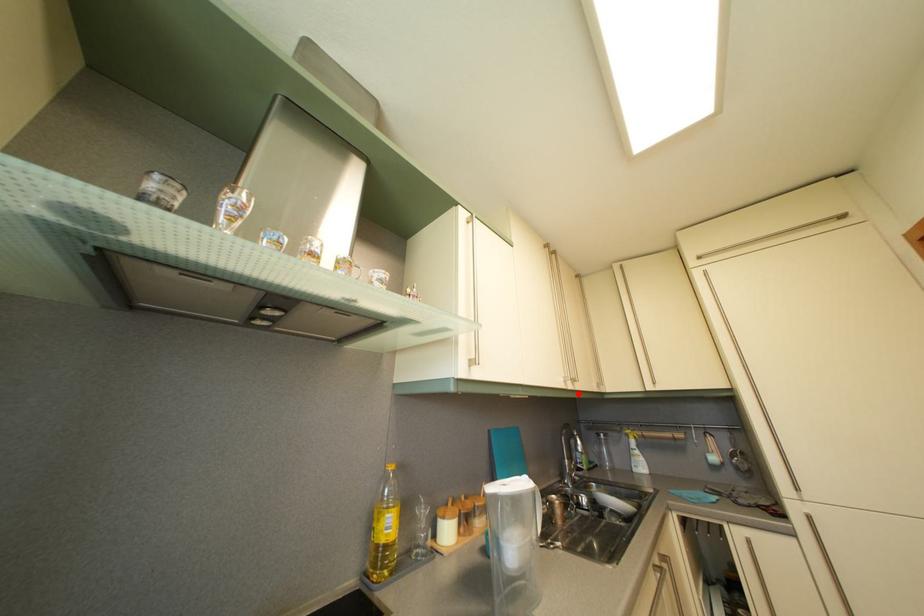
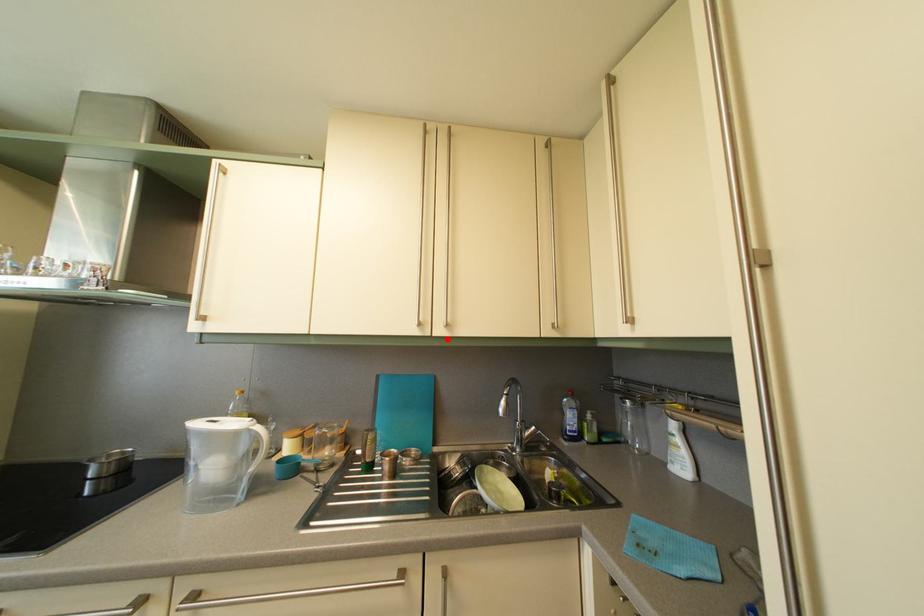
I am providing you with two images of the same scene from different viewpoints. A red point is marked on the first image and another point is marked on the second image. Is the marked point in image1 the same physical position as the marked point in image2?

Yes